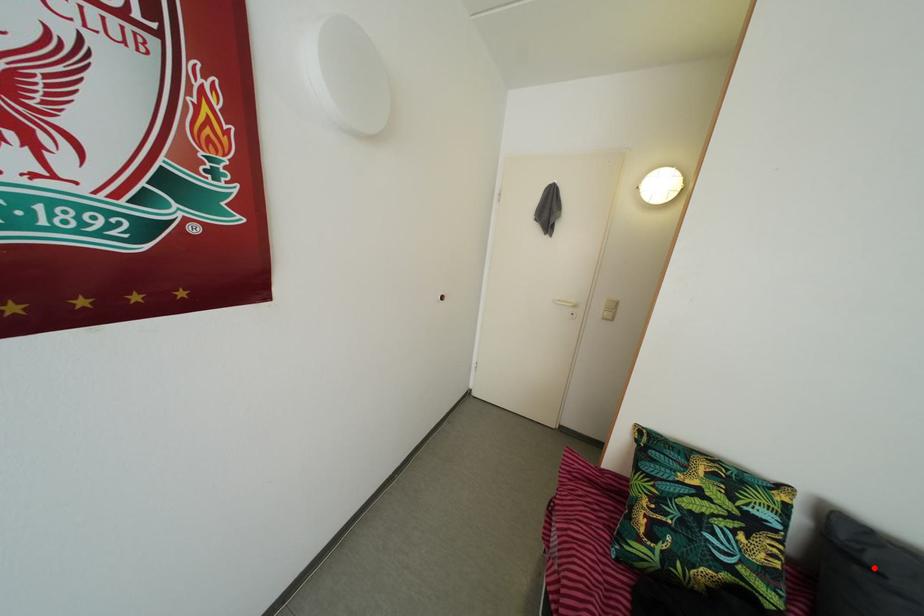
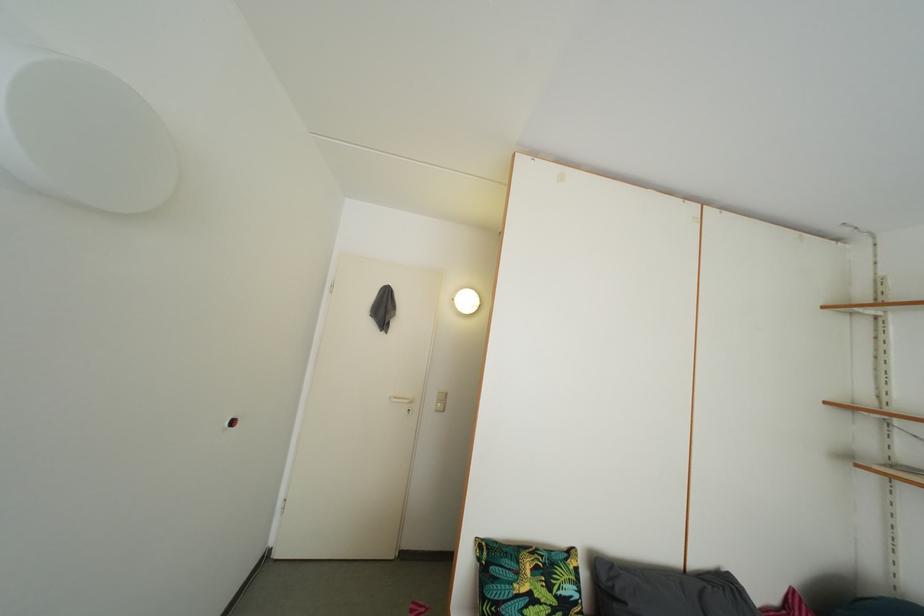
Question: A red point is marked in image1. In image2, is the corresponding 3D point closer to the camera or farther? Reply with the corresponding letter.

Choices:
 (A) The corresponding 3D point is closer.
 (B) The corresponding 3D point is farther.

Answer: (B)